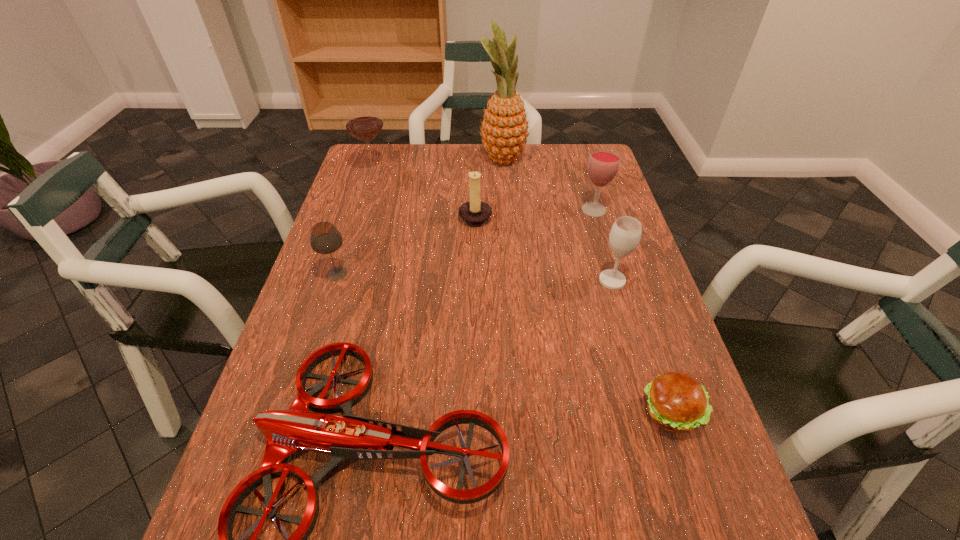
Find the location of a particular element. Image resolution: width=960 pixels, height=540 pixels. vacant space at the far right corner of the desktop is located at coordinates (578, 177).

I want to click on free spot between the farthest wineglass and the hamburger, so click(521, 292).

Where is `blank region between the shortest wineglass and the hamburger`? The width and height of the screenshot is (960, 540). blank region between the shortest wineglass and the hamburger is located at coordinates (503, 343).

Where is `vacant area that lies between the pineapple and the hamburger`? vacant area that lies between the pineapple and the hamburger is located at coordinates (587, 286).

This screenshot has height=540, width=960. I want to click on empty space that is in between the farthest wineglass and the candle holder, so click(424, 193).

Find the location of a particular element. This screenshot has width=960, height=540. free space between the third nearest wineglass and the shortest wineglass is located at coordinates (466, 242).

Identify the location of vacant region between the shortest wineglass and the third nearest wineglass. The height and width of the screenshot is (540, 960). (466, 242).

Point out which object is positioned as the seventh nearest to the farthest wineglass. Please provide its 2D coordinates. Your answer should be formatted as a tuple, i.e. [(x, y)], where the tuple contains the x and y coordinates of a point satisfying the conditions above.

[(677, 403)]

The image size is (960, 540). What are the coordinates of `object that stands as the sixth closest to the second farthest wineglass` in the screenshot? It's located at (363, 121).

Point out which wineglass is positioned as the second nearest to the drone. Please provide its 2D coordinates. Your answer should be formatted as a tuple, i.e. [(x, y)], where the tuple contains the x and y coordinates of a point satisfying the conditions above.

[(625, 234)]